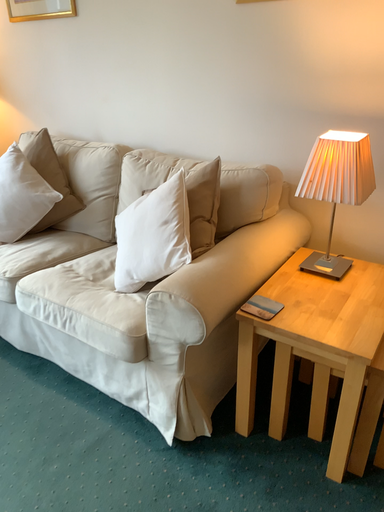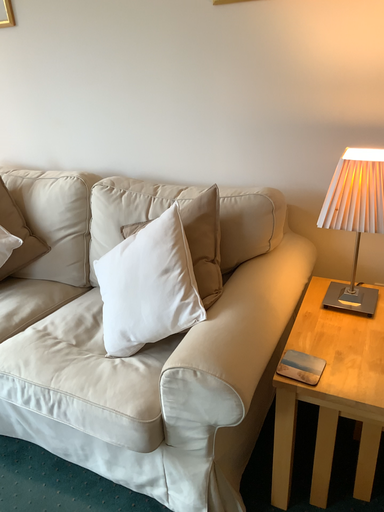
Question: Which way did the camera rotate in the video?

Choices:
 (A) rotated left
 (B) rotated right

Answer: (B)